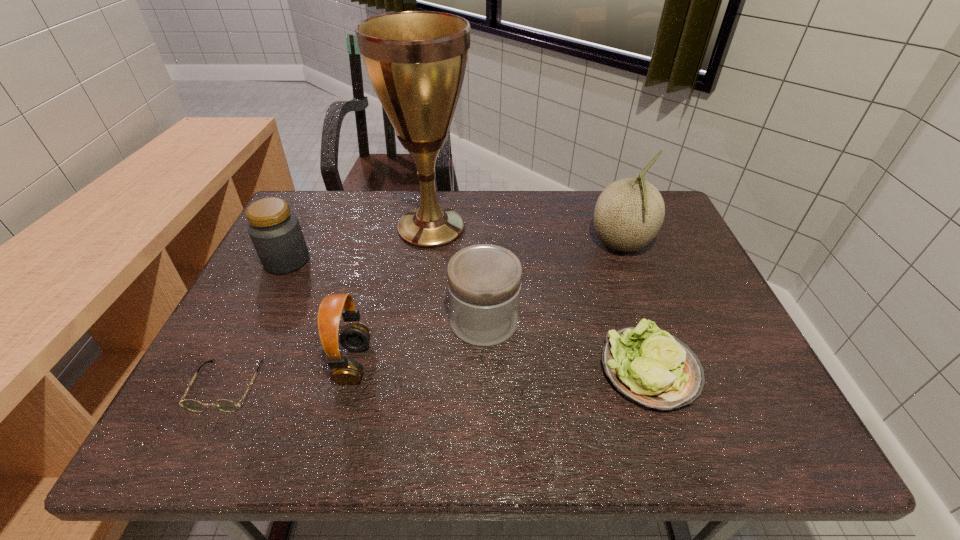
Image resolution: width=960 pixels, height=540 pixels. I want to click on vacant region that satisfies the following two spatial constraints: 1. on the back side of the second shortest object; 2. on the ear cups of the headset, so click(647, 363).